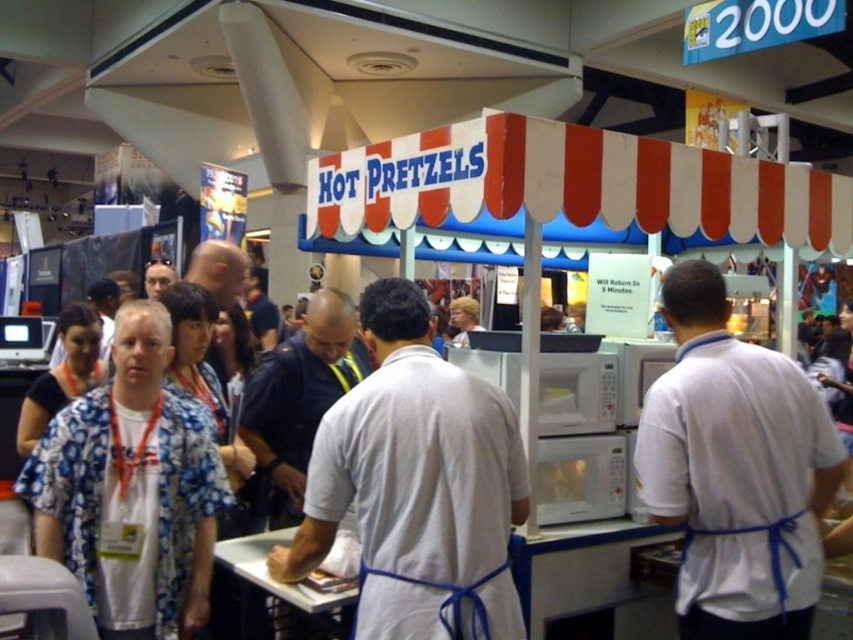
Does white fabric shirt at center have a greater height compared to white shirt at lower left?

Yes.

Which is behind, point (634, 454) or point (67, 372)?

Positioned behind is point (67, 372).

What are the coordinates of `white fabric shirt at center` in the screenshot? It's located at (735, 470).

Find the location of a particular element. white fabric shirt at center is located at coordinates (735, 470).

This screenshot has width=853, height=640. What do you see at coordinates (131, 490) in the screenshot?
I see `floral fabric shirt at left` at bounding box center [131, 490].

Based on the photo, is floral fabric shirt at left above white shirt at lower left?

Actually, floral fabric shirt at left is below white shirt at lower left.

The height and width of the screenshot is (640, 853). In order to click on floral fabric shirt at left in this screenshot , I will do `click(131, 490)`.

Where is `floral fabric shirt at left`? Image resolution: width=853 pixels, height=640 pixels. floral fabric shirt at left is located at coordinates (131, 490).

Is floral fabric shirt at left further to camera compared to light brown hair at center?

No, it is not.

Who is lower down, floral fabric shirt at left or light brown hair at center?

Positioned lower is floral fabric shirt at left.

Who is more distant from viewer, (140, 484) or (161, 285)?

Positioned behind is point (161, 285).

This screenshot has width=853, height=640. Identify the location of floral fabric shirt at left. (131, 490).